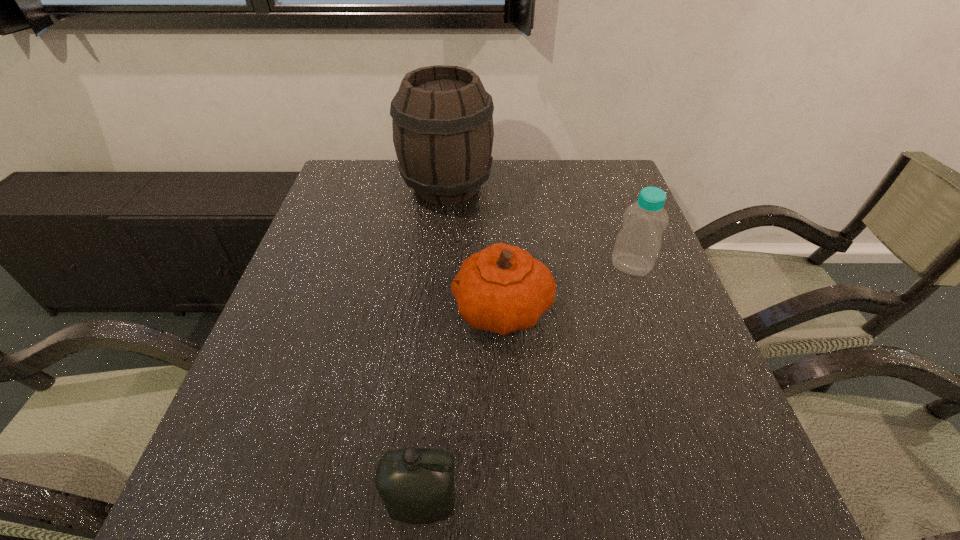
The image size is (960, 540). What are the coordinates of `free space between the farther bottle and the pumpkin` in the screenshot? It's located at (566, 287).

Where is `the third closest object to the farther bottle`? the third closest object to the farther bottle is located at coordinates (416, 485).

Identify which object is the third nearest to the pumpkin. Please provide its 2D coordinates. Your answer should be formatted as a tuple, i.e. [(x, y)], where the tuple contains the x and y coordinates of a point satisfying the conditions above.

[(416, 485)]

Locate an element on the screen. vacant space that satisfies the following two spatial constraints: 1. on the front side of the wine bucket; 2. on the left side of the taller bottle is located at coordinates (440, 265).

In order to click on free space that satisfies the following two spatial constraints: 1. on the front side of the farther bottle; 2. on the front-facing side of the pumpkin in this screenshot , I will do `click(647, 309)`.